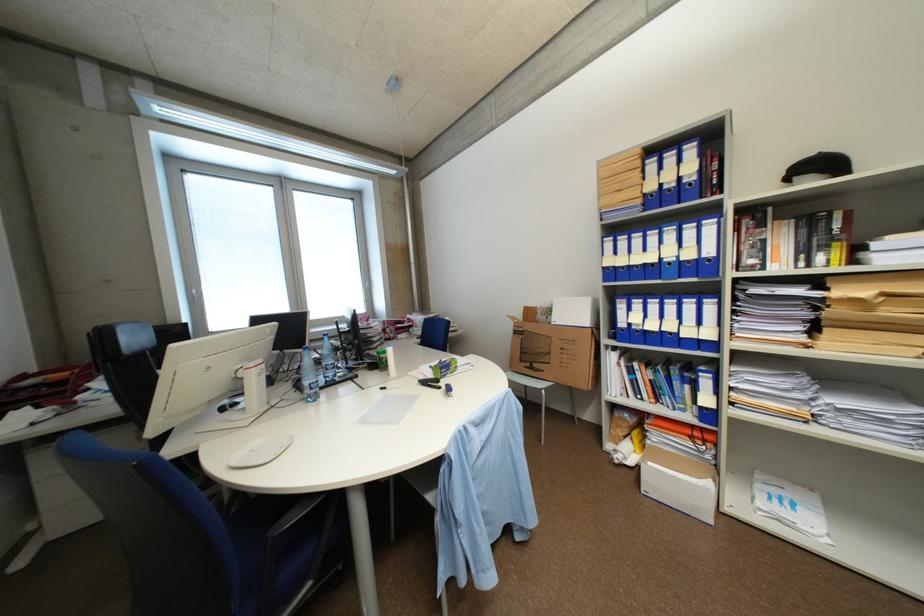
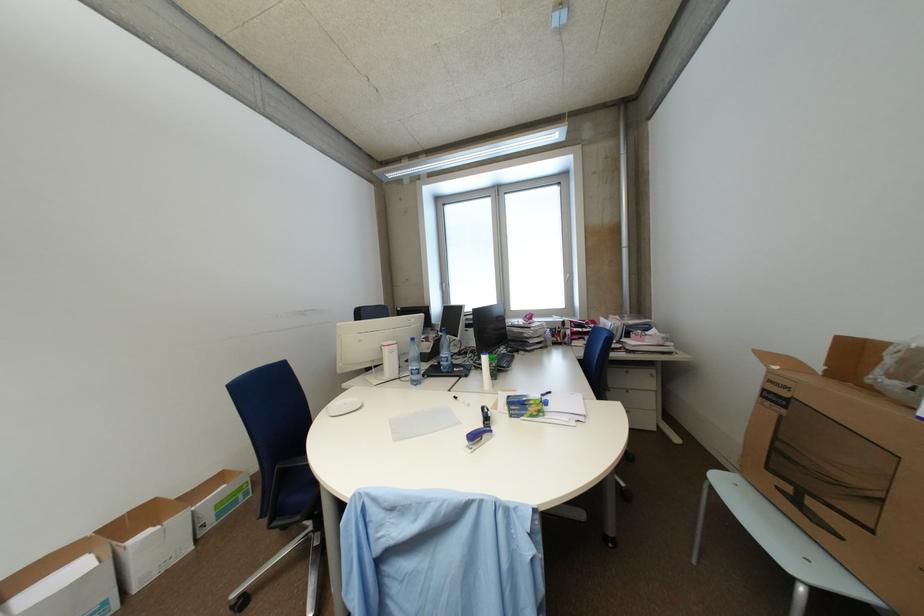
Locate, in the second image, the point that corresponds to (x=320, y=390) in the first image.

(420, 375)